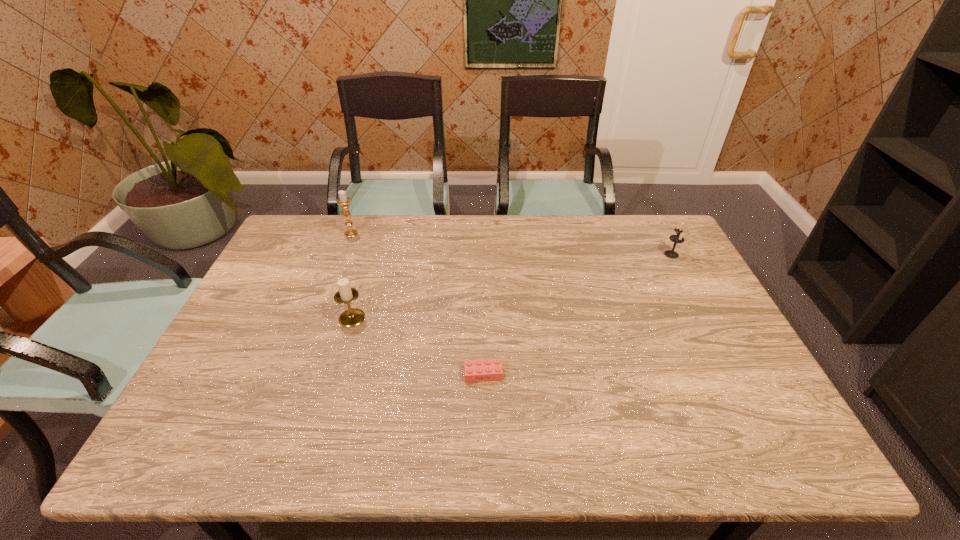
Identify the location of the tallest object. (343, 200).

What are the coordinates of `the tallest candle holder` in the screenshot? It's located at (343, 200).

This screenshot has height=540, width=960. I want to click on the nearest candle holder, so click(345, 295).

Locate an element on the screen. the third farthest object is located at coordinates (345, 295).

At what (x,y) coordinates should I click in order to perform the action: click on the rightmost object. Please return your answer as a coordinate pair (x, y). The image size is (960, 540). Looking at the image, I should click on (678, 238).

Find the location of a particular element. The width and height of the screenshot is (960, 540). the second farthest candle holder is located at coordinates (678, 238).

Where is `Lego`? Image resolution: width=960 pixels, height=540 pixels. Lego is located at coordinates (486, 369).

The width and height of the screenshot is (960, 540). Identify the location of the second object from right to left. (486, 369).

The image size is (960, 540). Find the location of `vacant region located on the front of the tallest object`. vacant region located on the front of the tallest object is located at coordinates (317, 326).

The width and height of the screenshot is (960, 540). Find the location of `free space located on the front of the third farthest object`. free space located on the front of the third farthest object is located at coordinates (318, 431).